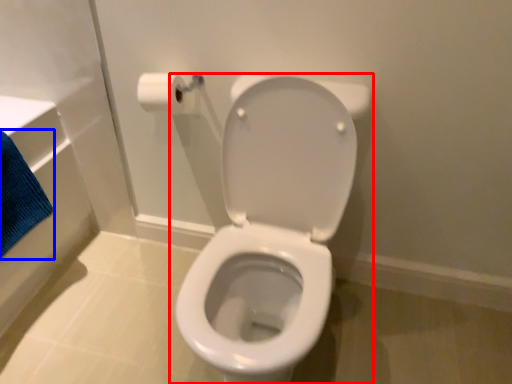
Question: Which of the following is the closest to the observer, toilet (highlighted by a red box) or bath towel (highlighted by a blue box)?

Choices:
 (A) toilet
 (B) bath towel

Answer: (A)